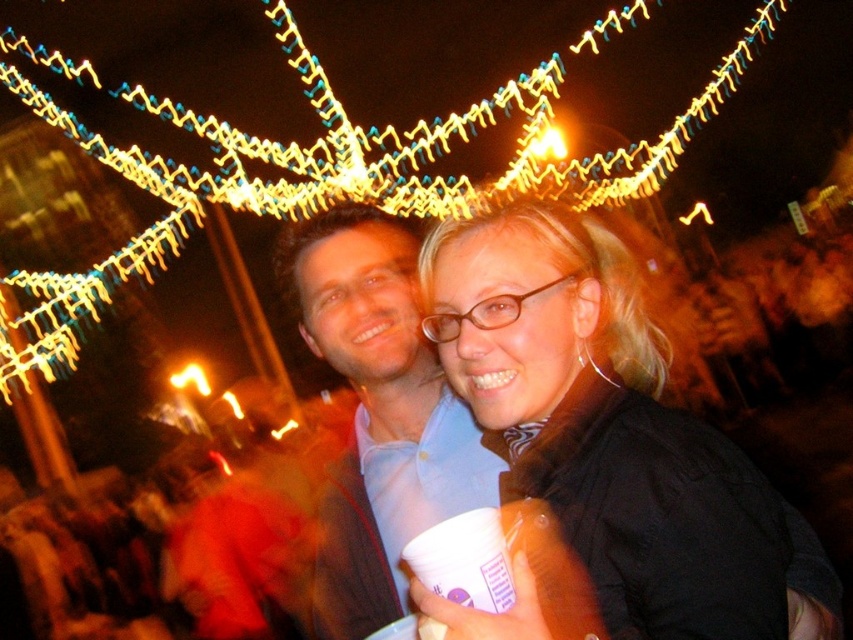
You are attending a nighttime event and want to take a photo of yourself with the yellow string lights at upper center and the matte blue shirt at center in the background. Which object will appear bigger in your photo?

The yellow string lights at upper center will appear bigger in the photo because they are larger in size compared to the matte blue shirt at center.